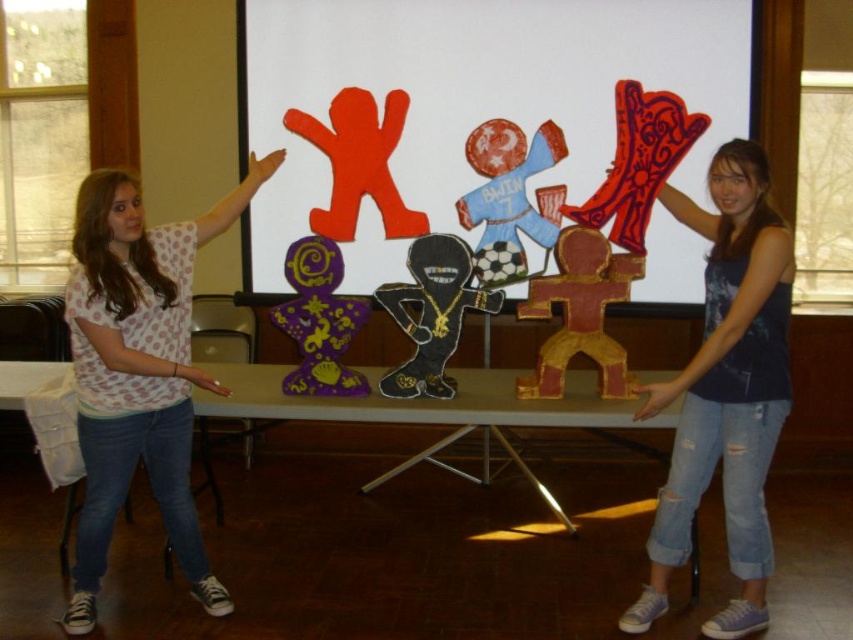
You are standing in front of the table where the two individuals are discussing the handcrafted figures. Based on the coordinates provided, where exactly is the blue denim jeans at center located in the image?

The blue denim jeans at center is located at the 2D coordinates point of (726, 390).